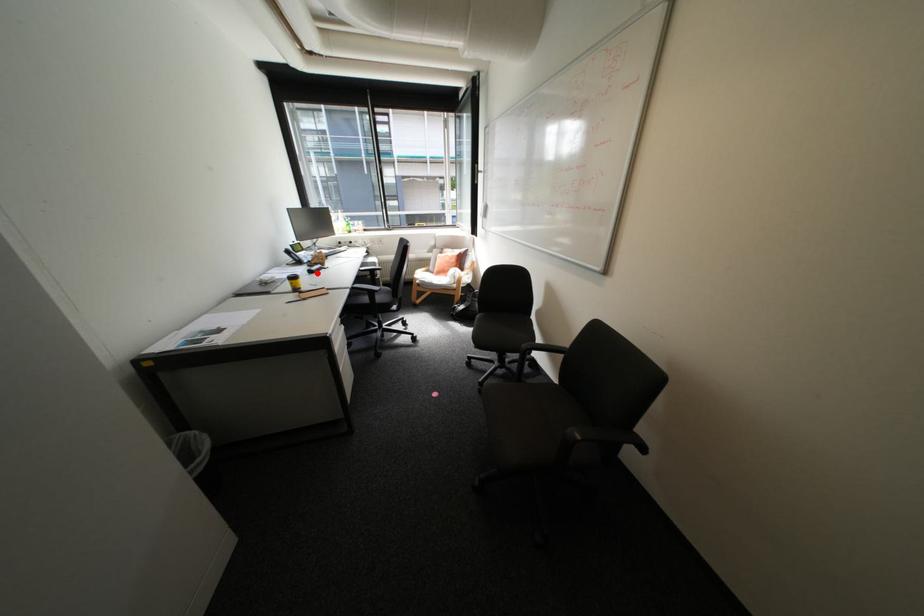
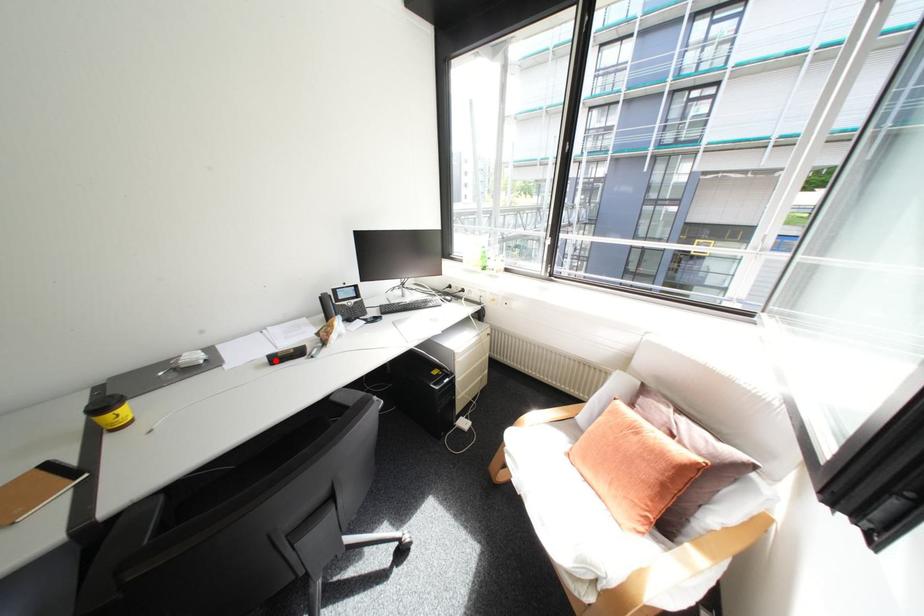
I am providing you with two images of the same scene from different viewpoints. A red point is marked on the first image and another point is marked on the second image. Is the red point in image1 aligned with the point shown in image2?

Yes